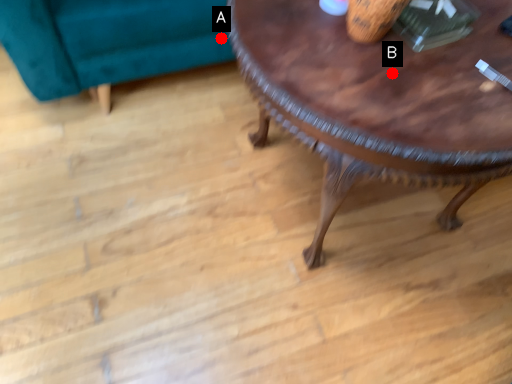
Question: Two points are circled on the image, labeled by A and B beside each circle. Among these points, which one is nearest to the camera?

Choices:
 (A) A is closer
 (B) B is closer

Answer: (B)